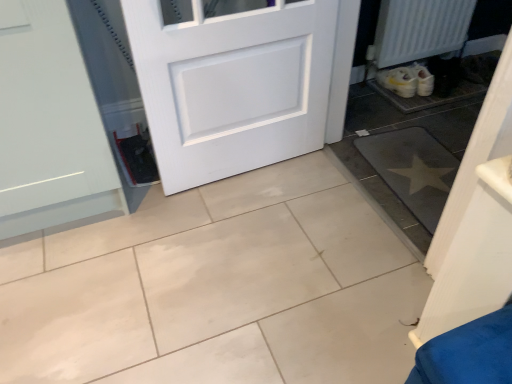
Question: Considering the relative positions of white glossy tile at center, acting as the first ceramic tile starting from the left, and white textured radiator at lower right in the image provided, is white glossy tile at center, acting as the first ceramic tile starting from the left, to the left or to the right of white textured radiator at lower right?

Choices:
 (A) left
 (B) right

Answer: (A)

Question: Considering their positions, is white glossy tile at center, which is the second ceramic tile from right to left, located in front of or behind white textured radiator at lower right?

Choices:
 (A) behind
 (B) front

Answer: (B)

Question: Which object is the closest to the gray matte mat at lower right, marked as the 2th ceramic tile in a left-to-right arrangement?

Choices:
 (A) white textured radiator at lower right
 (B) white matte door at center
 (C) white glossy tile at center, acting as the first ceramic tile starting from the left

Answer: (B)

Question: Which is farther from the white textured radiator at lower right?

Choices:
 (A) white matte door at center
 (B) gray matte mat at lower right, marked as the 2th ceramic tile in a left-to-right arrangement
 (C) white glossy tile at center, acting as the first ceramic tile starting from the left

Answer: (C)